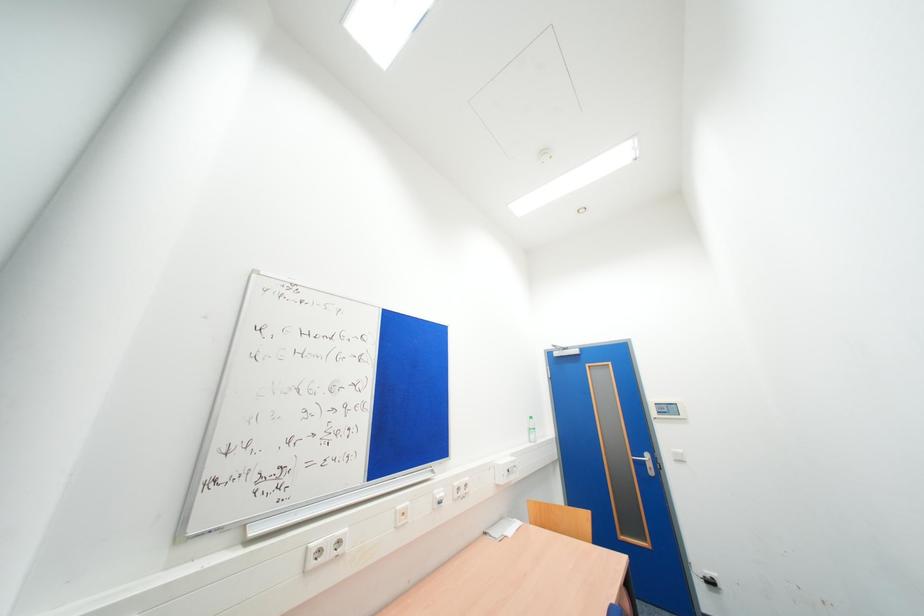
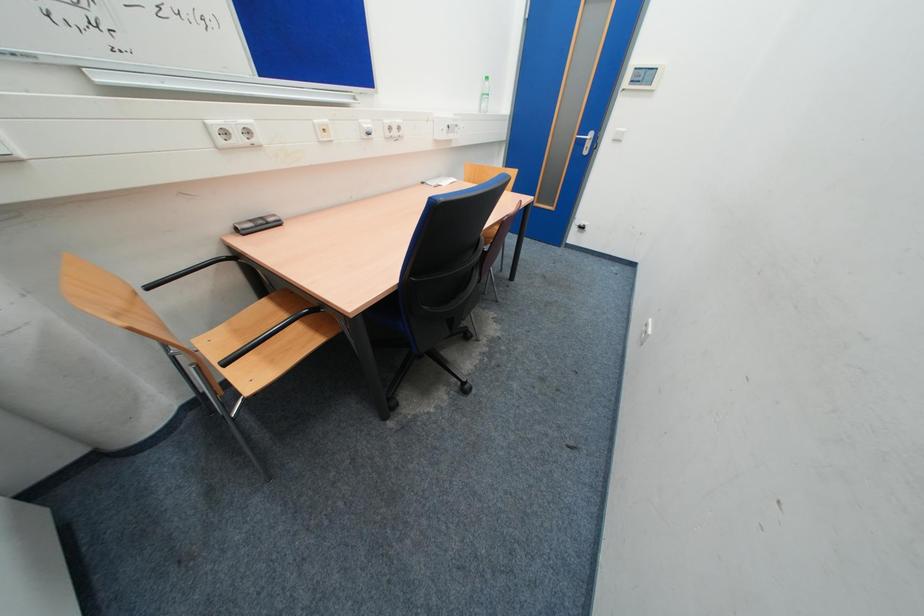
First-person continuous shooting, in which direction is the camera rotating?

The camera rotated toward right-down.